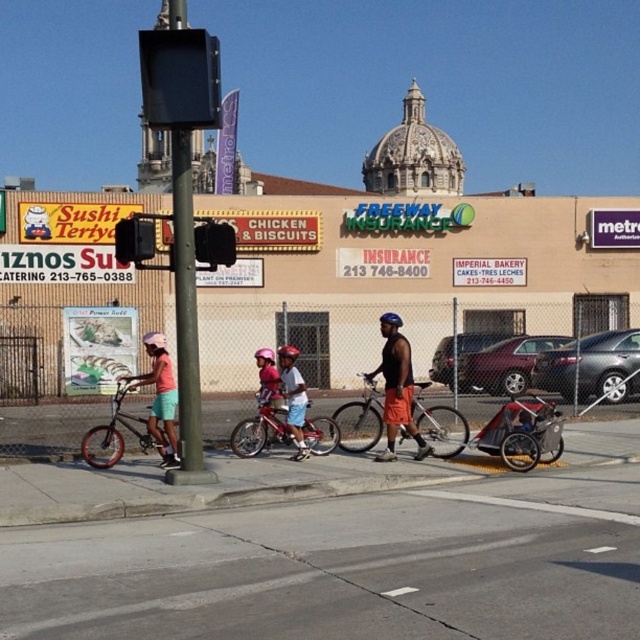
You are a delivery driver who needs to park your gray metallic sedan at center in a parking spot located at coordinates 0.6, 0.9. Can you safely park there?

The gray metallic sedan at center is positioned at point (589, 365), which is very close to the parking spot at (576, 384). Since the coordinates are nearly aligned, the driver can safely park there.

In the scene shown: You are a delivery person who needs to quickly assess if the metallic silver sedan at center can pass under a low bridge that is exactly the same height as the light blue denim shorts at center. Based on the scene, can the sedan pass under the bridge?

The metallic silver sedan at center has a lesser height compared to light blue denim shorts at center, so yes, the sedan can pass under the bridge since its height is lower than the bridge clearance which matches the shorts height.